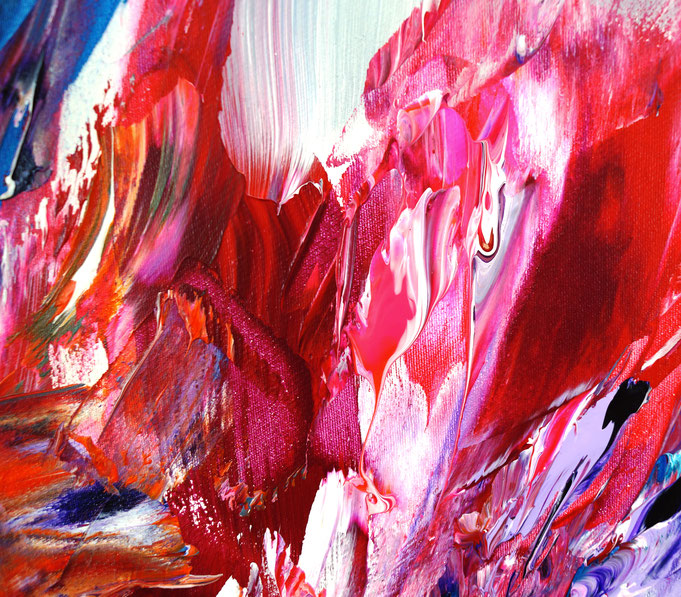
This screenshot has width=681, height=597. I want to click on paint, so click(x=227, y=201), click(x=364, y=359).